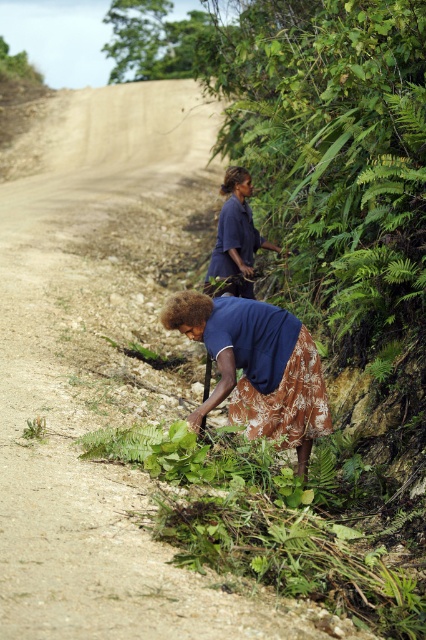
You are a photographer trying to capture the scene from the road. You notice the brown floral skirt at lower center and the dark blue fabric at center. Which object should you focus on first if you want to photograph the one closer to the left side of the frame?

The dark blue fabric at center is closer to the left side of the frame because the brown floral skirt at lower center is positioned to its right.

You are a photographer trying to capture a clear shot of the dark blue fabric at center while ensuring the brown floral skirt at lower center is visible in the frame. Can you position yourself so that both are visible without one blocking the other?

The brown floral skirt at lower center is in front of the dark blue fabric at center, so you cannot see the dark blue fabric at center behind it. You need to adjust your angle to capture both without obstruction.